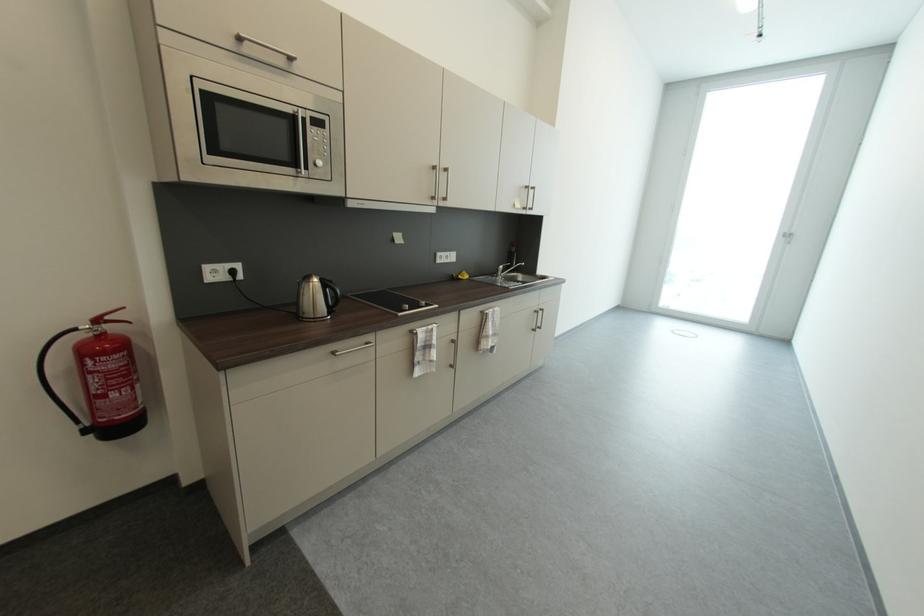
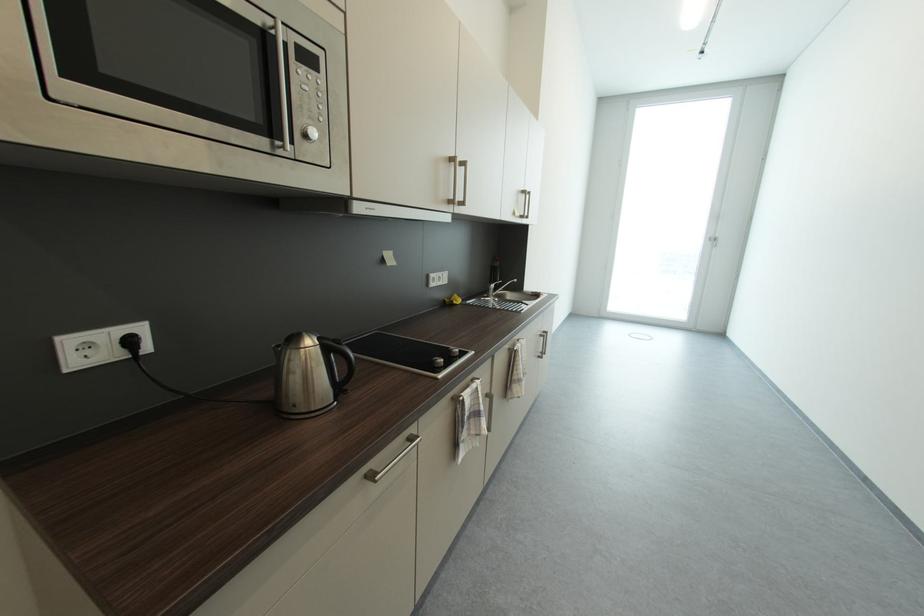
Where in the second image is the point corresponding to pixel 438 171 from the first image?

(455, 164)